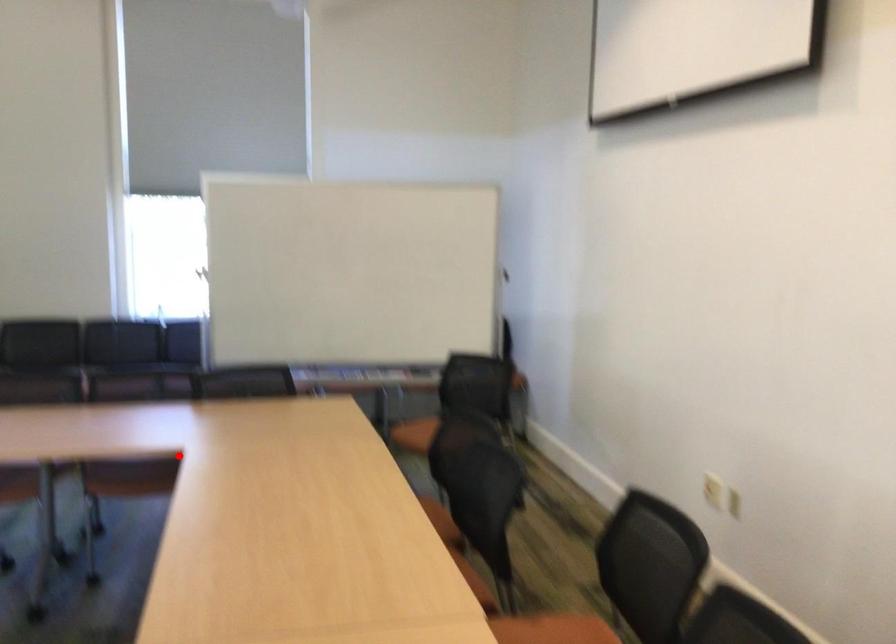
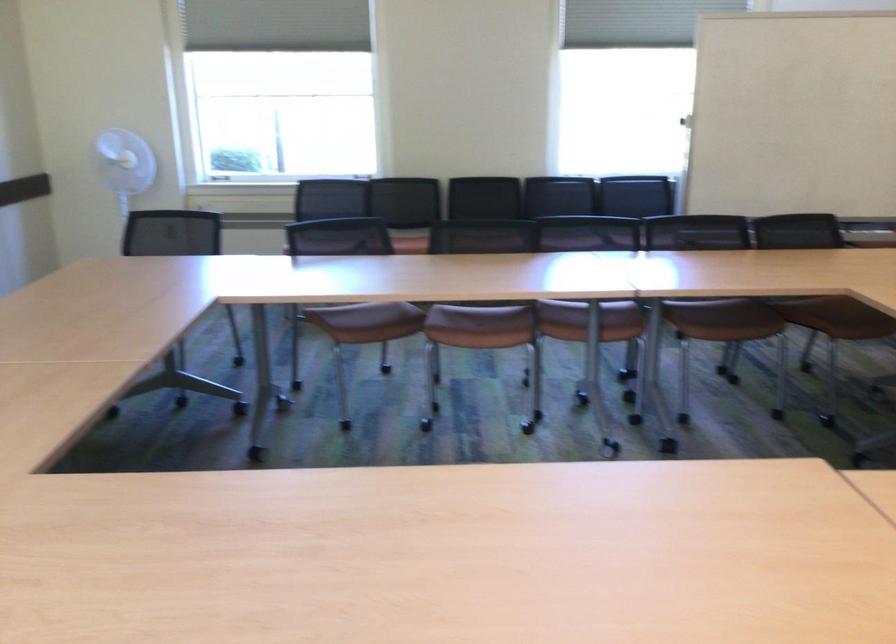
Find the pixel in the second image that matches the highlighted location in the first image.

(820, 295)